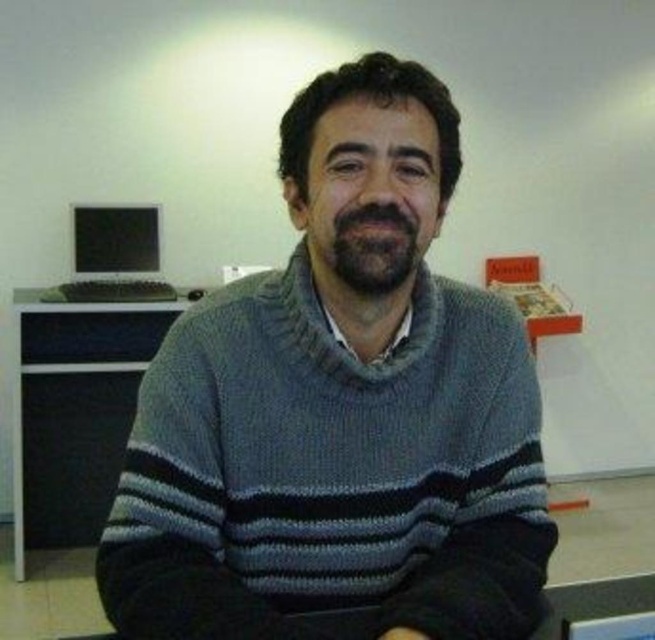
Question: Which point is farther to the camera?

Choices:
 (A) matte black monitor at left
 (B) gray knitted sweater at center

Answer: (A)

Question: Is gray knitted sweater at center below black plastic table at left?

Choices:
 (A) no
 (B) yes

Answer: (A)

Question: Which point appears closest to the camera in this image?

Choices:
 (A) (48, 493)
 (B) (413, 378)
 (C) (105, 205)

Answer: (B)

Question: Does black plastic table at left appear on the right side of matte black monitor at left?

Choices:
 (A) no
 (B) yes

Answer: (A)

Question: Does gray knitted sweater at center appear on the left side of black plastic table at left?

Choices:
 (A) yes
 (B) no

Answer: (B)

Question: Which of the following is the farthest from the observer?

Choices:
 (A) (22, 512)
 (B) (367, 408)

Answer: (A)